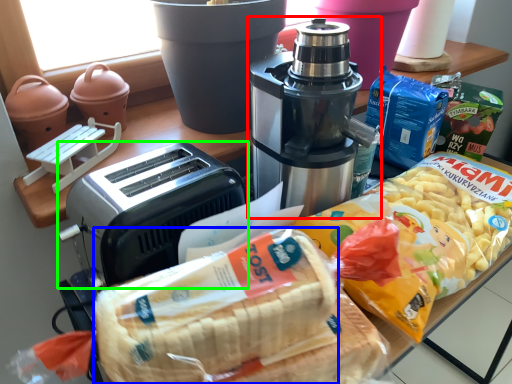
Question: Based on their relative distances, which object is farther from coffee maker (highlighted by a red box)? Choose from treat (highlighted by a blue box) and toaster (highlighted by a green box).

Choices:
 (A) treat
 (B) toaster

Answer: (A)